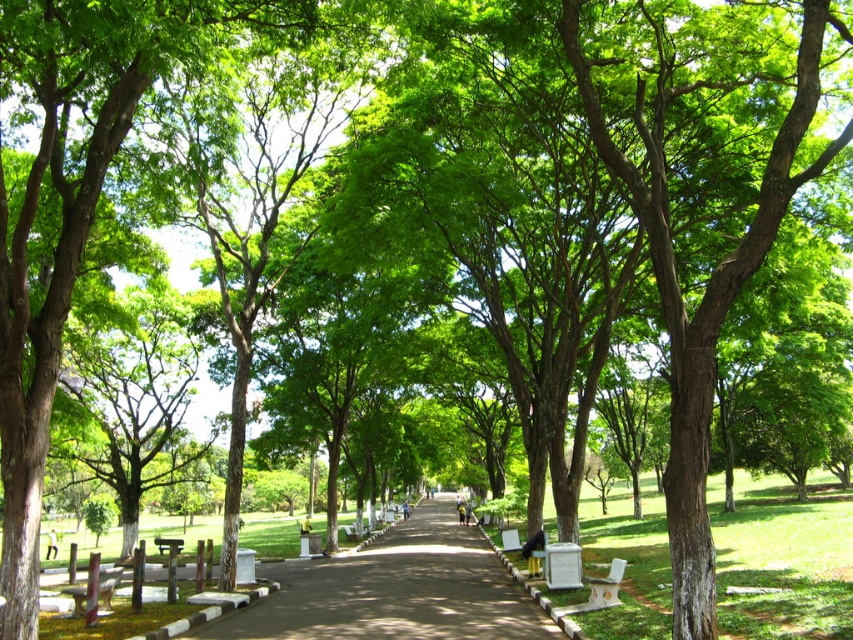
You are standing in the park and want to reach a specific location marked by the point at coordinates point (511, 588). If you walk straight ahead along the path, will you pass this point before reaching the end of the visible path?

The point (511, 588) is 67.01 feet from the viewer. Since the path is straight and the point is along the path, walking straight ahead will lead you to the point before reaching the end of the visible path.